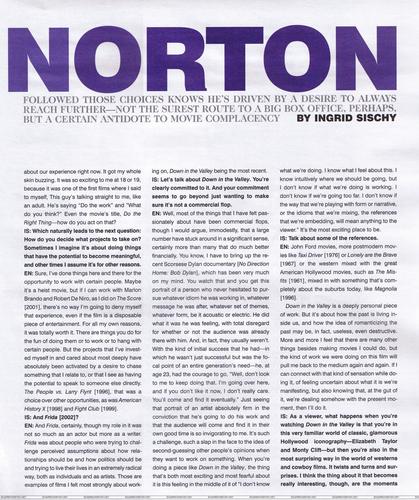
Where is `shadings`? This screenshot has height=500, width=419. shadings is located at coordinates (403, 153), (412, 403), (411, 346).